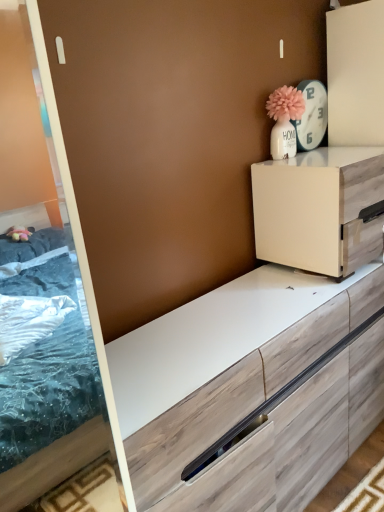
Question: Should I look upward or downward to see white matte cabinet at upper right?

Choices:
 (A) up
 (B) down

Answer: (A)

Question: Considering the relative sizes of white glossy clock at upper right and white matte cabinet at upper right in the image provided, is white glossy clock at upper right wider than white matte cabinet at upper right?

Choices:
 (A) yes
 (B) no

Answer: (B)

Question: Can white matte cabinet at upper right be found inside white glossy clock at upper right?

Choices:
 (A) no
 (B) yes

Answer: (A)

Question: Is white glossy clock at upper right with white matte cabinet at upper right?

Choices:
 (A) no
 (B) yes

Answer: (A)

Question: Is white glossy clock at upper right facing away from white matte cabinet at upper right?

Choices:
 (A) yes
 (B) no

Answer: (B)

Question: Is white glossy clock at upper right further to the viewer compared to white matte cabinet at upper right?

Choices:
 (A) no
 (B) yes

Answer: (B)

Question: Is white glossy clock at upper right smaller than white matte cabinet at upper right?

Choices:
 (A) no
 (B) yes

Answer: (B)

Question: Considering the relative positions of white matte cabinet at upper right and white glossy clock at upper right in the image provided, is white matte cabinet at upper right in front of white glossy clock at upper right?

Choices:
 (A) no
 (B) yes

Answer: (B)

Question: From the image's perspective, is white matte cabinet at upper right located beneath white glossy clock at upper right?

Choices:
 (A) no
 (B) yes

Answer: (B)

Question: From the image's perspective, is white matte cabinet at upper right on top of white glossy clock at upper right?

Choices:
 (A) yes
 (B) no

Answer: (B)

Question: Does white matte cabinet at upper right have a smaller size compared to white glossy clock at upper right?

Choices:
 (A) no
 (B) yes

Answer: (A)

Question: Does white matte cabinet at upper right have a greater width compared to white glossy clock at upper right?

Choices:
 (A) yes
 (B) no

Answer: (A)

Question: Is white matte cabinet at upper right oriented away from white glossy clock at upper right?

Choices:
 (A) no
 (B) yes

Answer: (A)

Question: Is white glossy clock at upper right wider or thinner than white matte cabinet at upper right?

Choices:
 (A) thin
 (B) wide

Answer: (A)